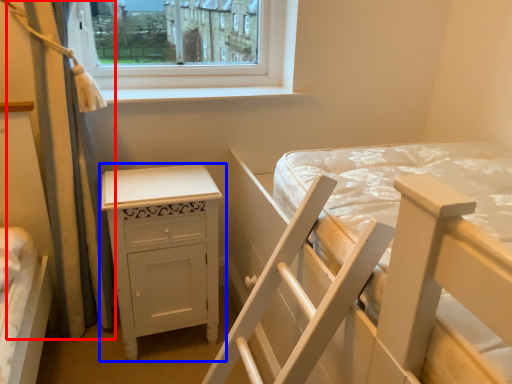
Question: Which of the following is the farthest to the observer, curtain (highlighted by a red box) or nightstand (highlighted by a blue box)?

Choices:
 (A) curtain
 (B) nightstand

Answer: (B)